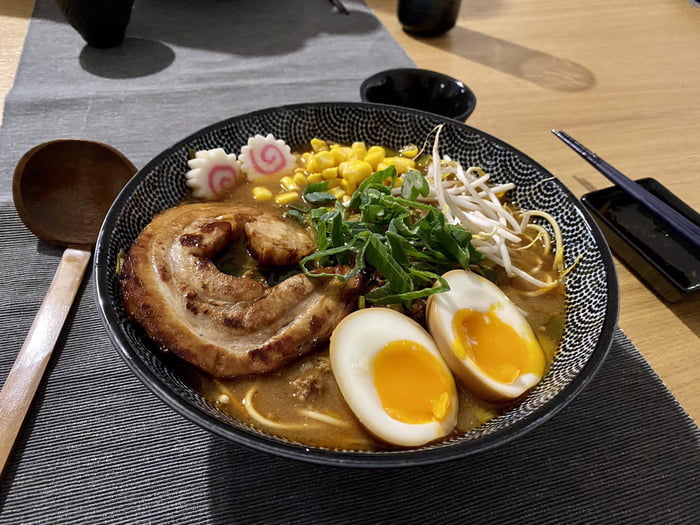
I want to click on chopsticks, so click(x=642, y=189).